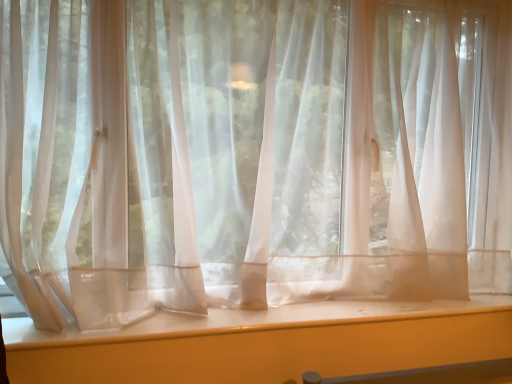
What do you see at coordinates (266, 343) in the screenshot? I see `smooth yellow window sill at center` at bounding box center [266, 343].

The height and width of the screenshot is (384, 512). What are the coordinates of `smooth yellow window sill at center` in the screenshot? It's located at (266, 343).

You are a GUI agent. You are given a task and a screenshot of the screen. Output one action in this format:
    pyautogui.click(x=<x>, y=<y>)
    Task: Click on the smooth yellow window sill at center
    
    Given the screenshot: What is the action you would take?
    pyautogui.click(x=266, y=343)